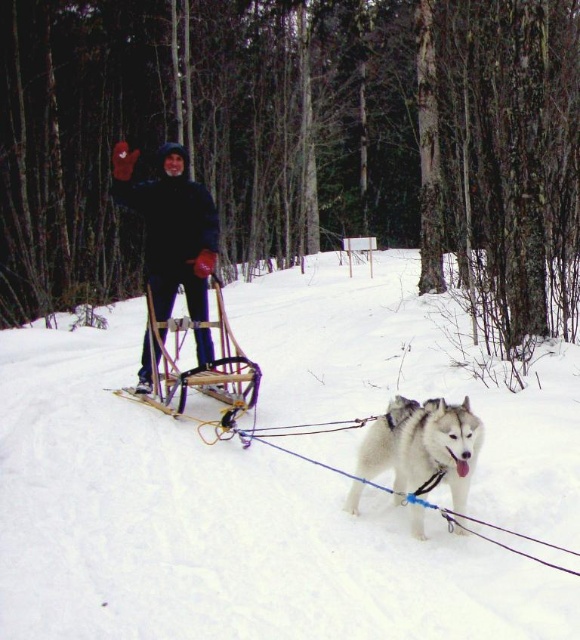
Who is positioned more to the left, white fluffy snow at center or black fabric jacket at center?

Positioned to the left is black fabric jacket at center.

Does white fluffy snow at center have a lesser height compared to black fabric jacket at center?

Correct, white fluffy snow at center is not as tall as black fabric jacket at center.

Image resolution: width=580 pixels, height=640 pixels. Describe the element at coordinates (215, 525) in the screenshot. I see `white fluffy snow at center` at that location.

In order to click on white fluffy snow at center in this screenshot , I will do `click(215, 525)`.

Is white fluffy snow at center below white fur dog at center?

No, white fluffy snow at center is not below white fur dog at center.

In the scene shown: Between white fluffy snow at center and white fur dog at center, which one has more height?

white fluffy snow at center

Measure the distance between white fluffy snow at center and camera.

white fluffy snow at center and camera are 3.34 meters apart.

At what (x,y) coordinates should I click in order to perform the action: click on white fluffy snow at center. Please return your answer as a coordinate pair (x, y). The width and height of the screenshot is (580, 640). Looking at the image, I should click on (215, 525).

Does black fabric jacket at center appear over white fur dog at center?

Yes, black fabric jacket at center is above white fur dog at center.

Is point (140, 376) positioned after point (383, 440)?

Yes, point (140, 376) is behind point (383, 440).

This screenshot has height=640, width=580. What do you see at coordinates (171, 227) in the screenshot? I see `black fabric jacket at center` at bounding box center [171, 227].

What are the coordinates of `black fabric jacket at center` in the screenshot? It's located at (171, 227).